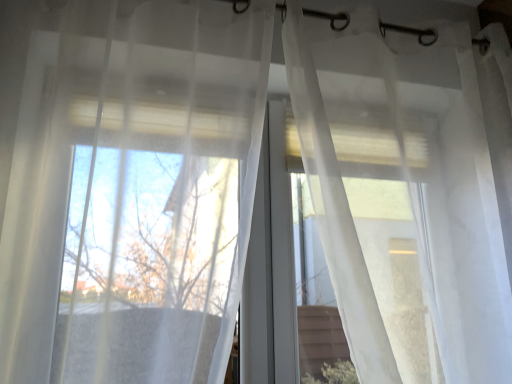
Question: From their relative heights in the image, would you say translucent white curtain at center, the 1th curtain from the left, is taller or shorter than translucent white curtain at center, the first curtain in the right-to-left sequence?

Choices:
 (A) tall
 (B) short

Answer: (B)

Question: Considering the positions of translucent white curtain at center, which ranks as the 2th curtain in right-to-left order, and translucent white curtain at center, which ranks as the 2th curtain in left-to-right order, in the image, is translucent white curtain at center, which ranks as the 2th curtain in right-to-left order, wider or thinner than translucent white curtain at center, which ranks as the 2th curtain in left-to-right order,?

Choices:
 (A) thin
 (B) wide

Answer: (B)

Question: Choose the correct answer: Is translucent white curtain at center, which ranks as the 2th curtain in right-to-left order, inside translucent white curtain at center, the first curtain in the right-to-left sequence, or outside it?

Choices:
 (A) outside
 (B) inside

Answer: (A)

Question: Does point pyautogui.click(x=386, y=319) appear closer or farther from the camera than point pyautogui.click(x=147, y=322)?

Choices:
 (A) closer
 (B) farther

Answer: (B)

Question: Looking at the image, does translucent white curtain at center, which ranks as the 2th curtain in left-to-right order, seem bigger or smaller compared to translucent white curtain at center, which ranks as the 2th curtain in right-to-left order?

Choices:
 (A) big
 (B) small

Answer: (A)

Question: Is translucent white curtain at center, the first curtain in the right-to-left sequence, taller or shorter than translucent white curtain at center, the 1th curtain from the left?

Choices:
 (A) short
 (B) tall

Answer: (B)

Question: In the image, is translucent white curtain at center, which ranks as the 2th curtain in left-to-right order, positioned in front of or behind translucent white curtain at center, which ranks as the 2th curtain in right-to-left order?

Choices:
 (A) front
 (B) behind

Answer: (B)